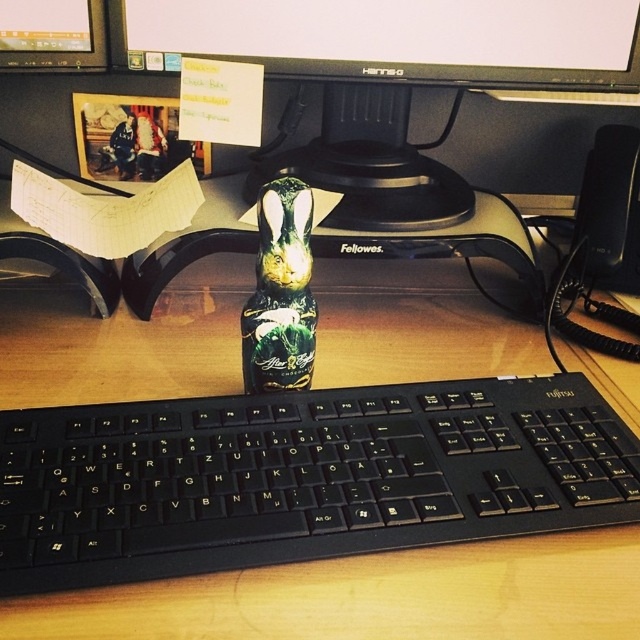
Question: Can you confirm if black glossy computer monitor at upper center is smaller than green matte bottle at center?

Choices:
 (A) yes
 (B) no

Answer: (B)

Question: Which point is closer to the camera?

Choices:
 (A) (262, 227)
 (B) (230, 410)
 (C) (323, 42)
 (D) (417, 42)

Answer: (A)

Question: Is black plastic keyboard at center positioned before green matte bottle at center?

Choices:
 (A) no
 (B) yes

Answer: (B)

Question: Which of the following is the closest to the observer?

Choices:
 (A) (250, 358)
 (B) (628, 83)

Answer: (A)

Question: Which object is closer to the camera taking this photo?

Choices:
 (A) black glossy computer monitor at upper center
 (B) green matte bottle at center
 (C) black plastic keyboard at center

Answer: (C)

Question: Is matte black monitor at upper center positioned behind black glossy computer monitor at upper center?

Choices:
 (A) yes
 (B) no

Answer: (B)